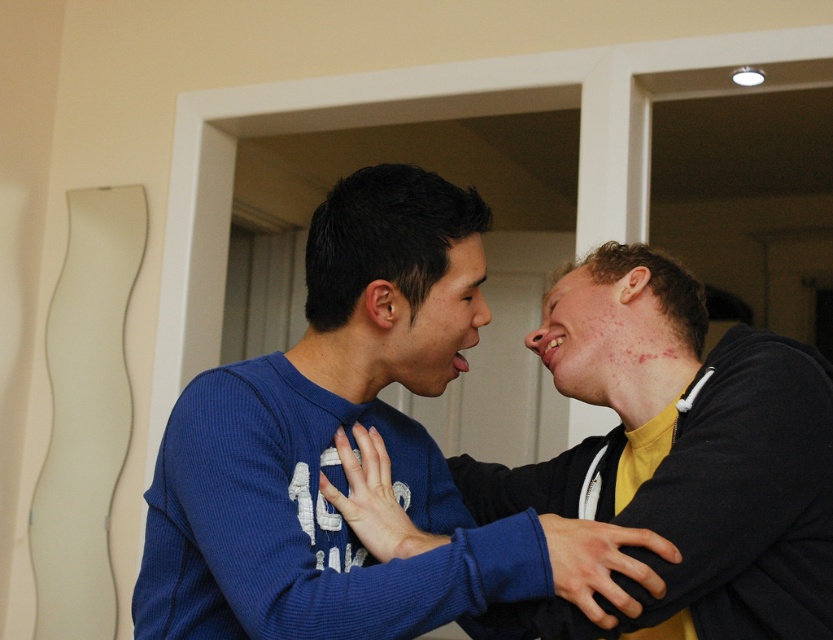
Question: Among these objects, which one is farthest from the camera?

Choices:
 (A) blue thermal sweater at center
 (B) matte blue sweater at center

Answer: (B)

Question: Which point appears closest to the camera in this image?

Choices:
 (A) (395, 342)
 (B) (671, 502)

Answer: (B)

Question: Does blue thermal sweater at center appear under matte blue sweater at center?

Choices:
 (A) yes
 (B) no

Answer: (A)

Question: Does blue thermal sweater at center appear on the left side of matte blue sweater at center?

Choices:
 (A) yes
 (B) no

Answer: (A)

Question: Which point is farther from the camera taking this photo?

Choices:
 (A) (223, 412)
 (B) (590, 291)

Answer: (B)

Question: From the image, what is the correct spatial relationship of blue thermal sweater at center in relation to matte blue sweater at center?

Choices:
 (A) above
 (B) below

Answer: (B)